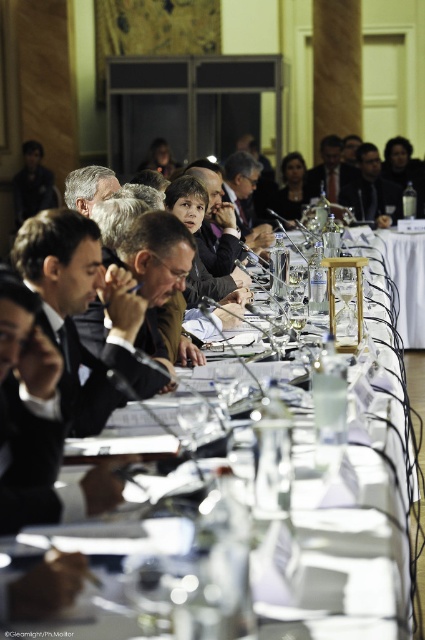
Question: Does black suit at center appear on the left side of matte black suit at center?

Choices:
 (A) no
 (B) yes

Answer: (B)

Question: Which point appears closest to the camera in this image?

Choices:
 (A) (44, 241)
 (B) (331, 164)

Answer: (A)

Question: Which point is farther from the camera taking this photo?

Choices:
 (A) (96, 266)
 (B) (78, 172)
 (C) (334, 202)

Answer: (C)

Question: Does white paper at center appear over matte black suit at center?

Choices:
 (A) no
 (B) yes

Answer: (A)

Question: Is black suit at center further to the viewer compared to matte black suit at center?

Choices:
 (A) no
 (B) yes

Answer: (A)

Question: Which of the following is the closest to the observer?

Choices:
 (A) black suit at center
 (B) matte black suit at center
 (C) dark brown leather jacket at center
 (D) matte black jacket at upper center

Answer: (A)